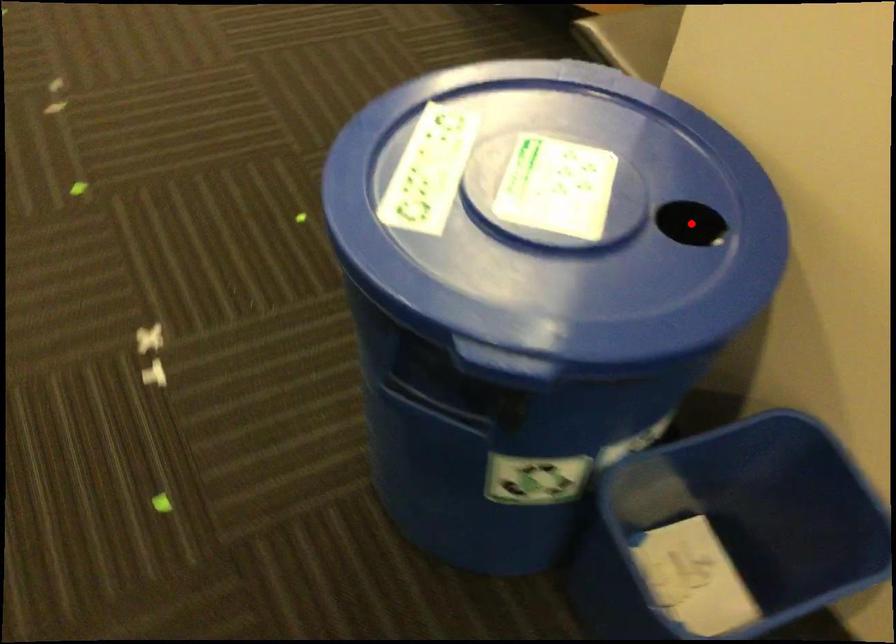
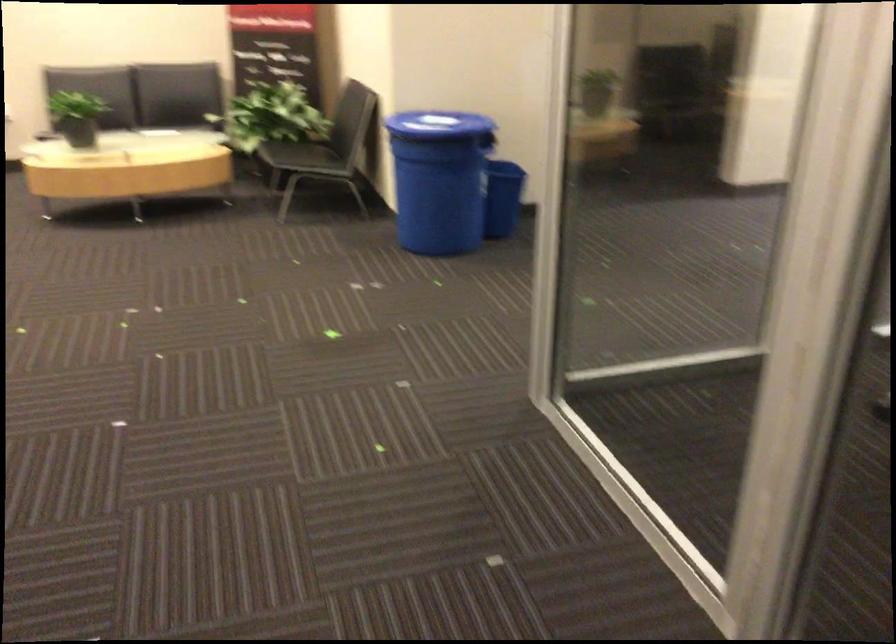
Question: I am providing you with two images of the same scene from different viewpoints. A red point is marked on the first image. Can you still see the location of the red point in image 2?

Choices:
 (A) Yes
 (B) No

Answer: (B)